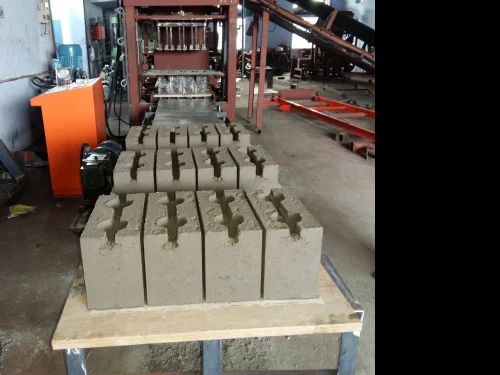
Identify the location of control panel. The width and height of the screenshot is (500, 375). (83, 129).